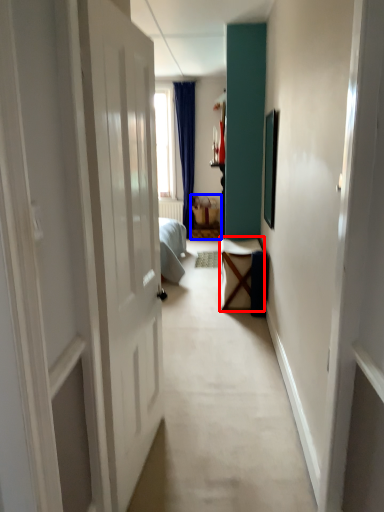
Question: Which object appears closest to the camera in this image, furniture (highlighted by a red box) or furniture (highlighted by a blue box)?

Choices:
 (A) furniture
 (B) furniture

Answer: (A)